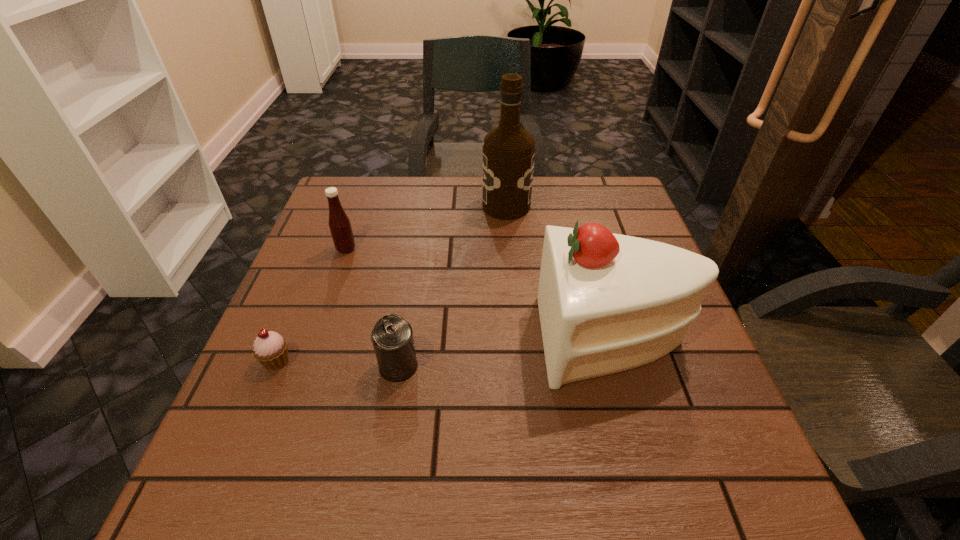
The height and width of the screenshot is (540, 960). Find the location of `alcohol`. alcohol is located at coordinates (508, 152).

Where is `the tallest object`? the tallest object is located at coordinates (508, 152).

This screenshot has height=540, width=960. Find the location of `cake`. cake is located at coordinates (607, 302).

At what (x,y) coordinates should I click in order to perform the action: click on the third shortest object. Please return your answer as a coordinate pair (x, y). Image resolution: width=960 pixels, height=540 pixels. Looking at the image, I should click on click(x=340, y=227).

Locate an element on the screen. The height and width of the screenshot is (540, 960). the second object from left to right is located at coordinates (340, 227).

Image resolution: width=960 pixels, height=540 pixels. Identify the location of the third object from left to right. (392, 336).

At what (x,y) coordinates should I click in order to perform the action: click on can. Please return your answer as a coordinate pair (x, y). Looking at the image, I should click on [392, 336].

What are the coordinates of `the shortest object` in the screenshot? It's located at (270, 348).

The height and width of the screenshot is (540, 960). I want to click on the leftmost object, so click(270, 348).

The image size is (960, 540). Identify the location of vacant space located 0.130m on the label of the tallest object. (435, 206).